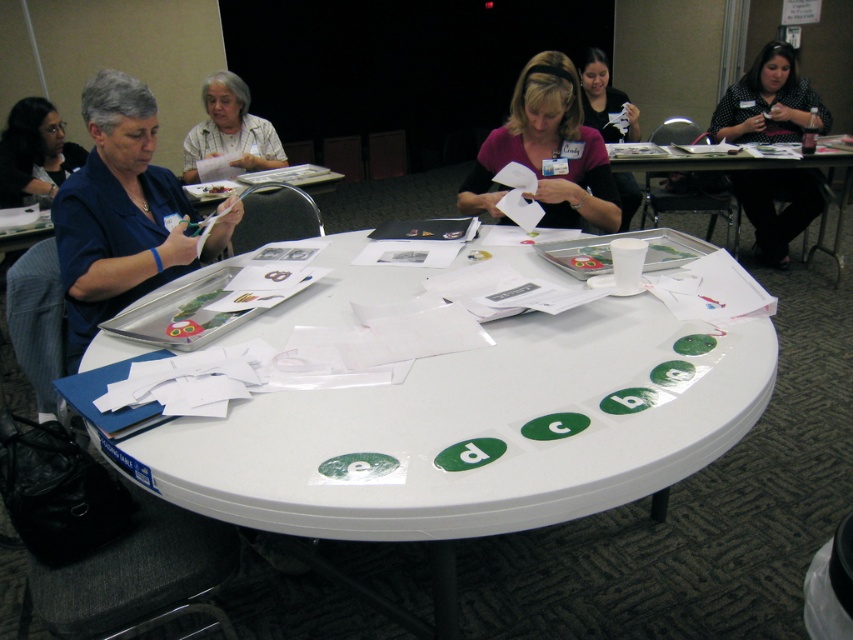
Question: Does white plastic table at center appear on the left side of white paper at center?

Choices:
 (A) no
 (B) yes

Answer: (B)

Question: Which point is farther to the camera?

Choices:
 (A) (474, 476)
 (B) (248, 97)

Answer: (B)

Question: Can you confirm if black dotted shirt at upper right is positioned to the left of white paper at upper center?

Choices:
 (A) yes
 (B) no

Answer: (B)

Question: Which point is farther to the camera?

Choices:
 (A) (599, 188)
 (B) (44, 134)
 (C) (236, 148)
 (D) (682, 157)

Answer: (C)

Question: Is white plastic table at center positioned at the back of blue fabric shirt at upper left?

Choices:
 (A) yes
 (B) no

Answer: (B)

Question: Which point is closer to the camera taking this photo?

Choices:
 (A) (770, 157)
 (B) (53, 192)
 (C) (670, 417)

Answer: (C)